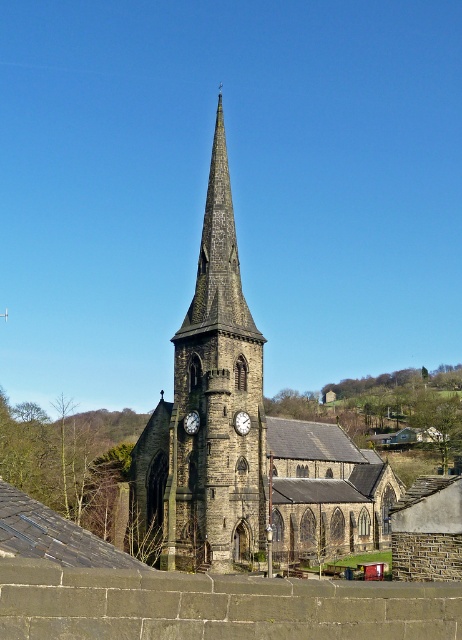
Question: Can you confirm if dark stone church at center is wider than metallic clock at center?

Choices:
 (A) yes
 (B) no

Answer: (A)

Question: Which object is farther from the camera taking this photo?

Choices:
 (A) dark stone church at center
 (B) white textured clock at center

Answer: (B)

Question: Which of these objects is positioned closest to the dark stone church at center?

Choices:
 (A) metallic clock at center
 (B) white textured clock at center

Answer: (A)

Question: Can you confirm if dark stone church at center is bigger than white textured clock at center?

Choices:
 (A) no
 (B) yes

Answer: (B)

Question: Observing the image, what is the correct spatial positioning of dark stone church at center in reference to white textured clock at center?

Choices:
 (A) above
 (B) below

Answer: (A)

Question: Which object is the farthest from the metallic clock at center?

Choices:
 (A) white textured clock at center
 (B) dark stone church at center

Answer: (B)